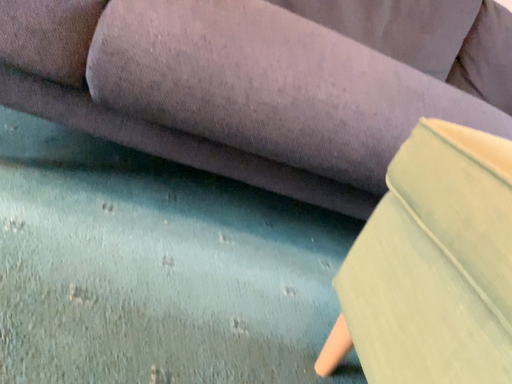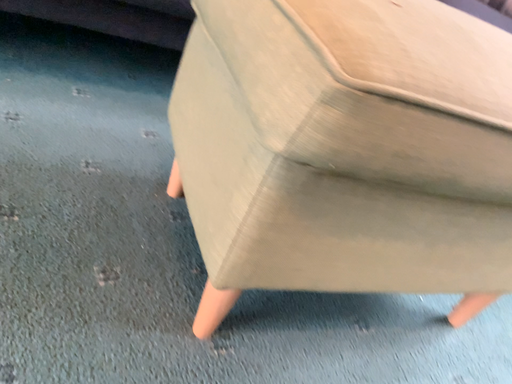
Question: How did the camera likely rotate when shooting the video?

Choices:
 (A) rotated right
 (B) rotated left

Answer: (A)